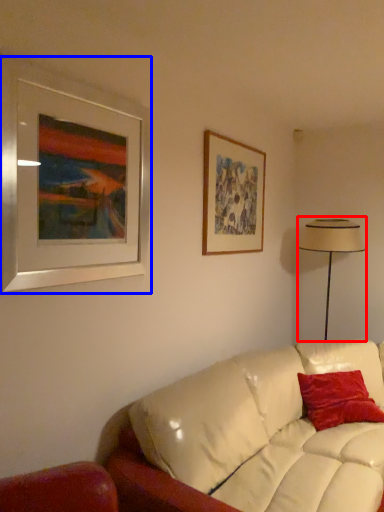
Question: Among these objects, which one is nearest to the camera, table lamp (highlighted by a red box) or picture frame (highlighted by a blue box)?

Choices:
 (A) table lamp
 (B) picture frame

Answer: (B)